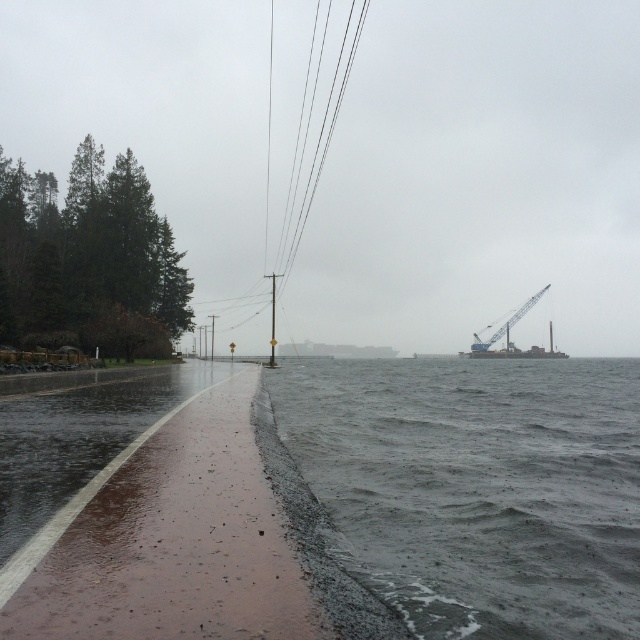
Question: Which of the following is the closest to the observer?

Choices:
 (A) (509, 323)
 (B) (326, 116)
 (C) (497, 596)

Answer: (C)

Question: Which point is closer to the camera taking this photo?

Choices:
 (A) (308, 193)
 (B) (484, 346)
 (C) (426, 588)

Answer: (C)

Question: Which point is closer to the camera?

Choices:
 (A) dark gray water at lower right
 (B) black wire at center
 (C) metallic blue crane at right

Answer: (A)

Question: Does dark gray water at lower right have a greater width compared to metallic blue crane at right?

Choices:
 (A) no
 (B) yes

Answer: (A)

Question: Is black wire at center to the right of metallic blue crane at right from the viewer's perspective?

Choices:
 (A) no
 (B) yes

Answer: (A)

Question: Is black wire at center below metallic blue crane at right?

Choices:
 (A) no
 (B) yes

Answer: (A)